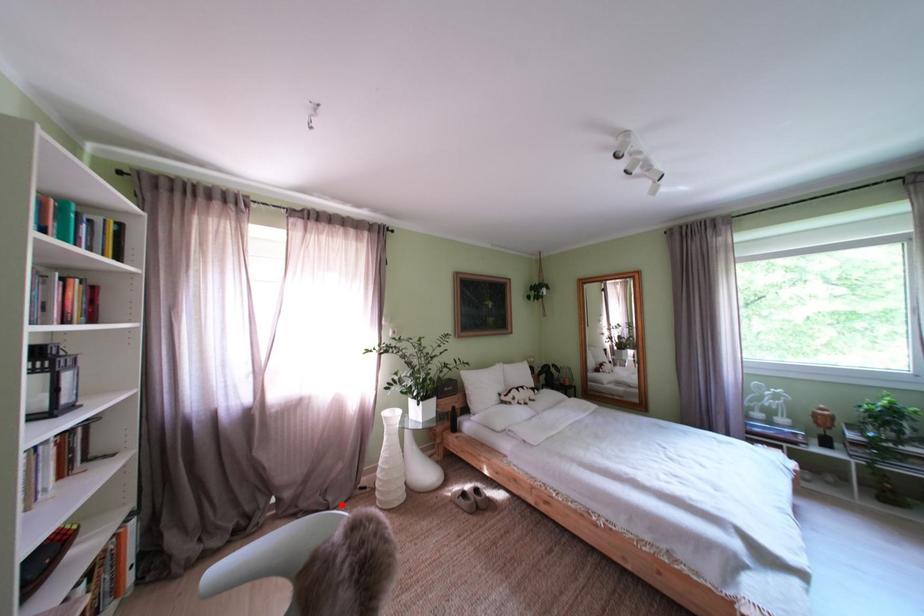
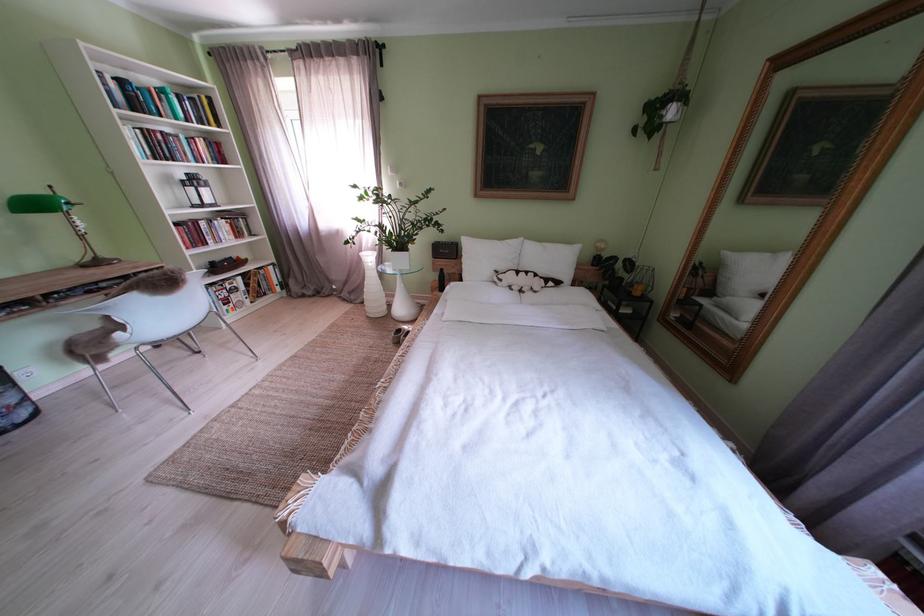
Where in the second image is the point corresponding to the highlighted location from the first image?

(363, 302)